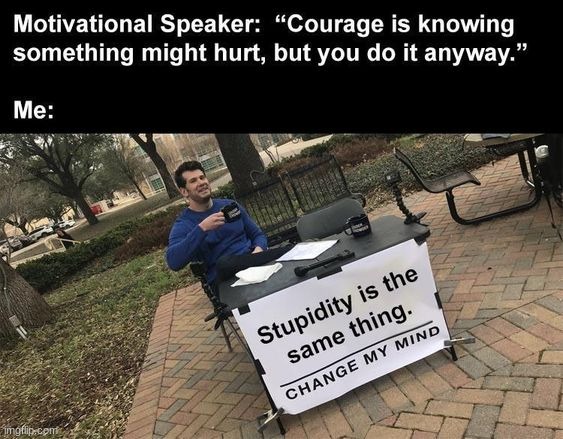
At what (x,y) coordinates should I click in order to perform the action: click on mug. Please return your answer as a coordinate pair (x, y). This screenshot has height=439, width=563. Looking at the image, I should click on (230, 209), (361, 228).